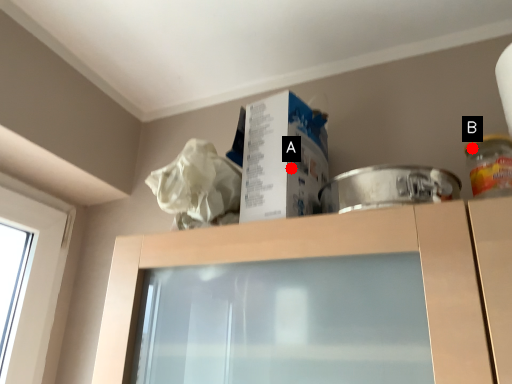
Question: Two points are circled on the image, labeled by A and B beside each circle. Which point is closer to the camera taking this photo?

Choices:
 (A) A is closer
 (B) B is closer

Answer: (A)